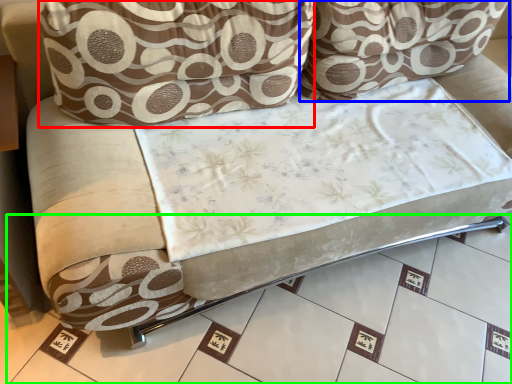
Question: Estimate the real-world distances between objects in this image. Which object is closer to throw pillow (highlighted by a red box), throw pillow (highlighted by a blue box) or tile (highlighted by a green box)?

Choices:
 (A) throw pillow
 (B) tile

Answer: (A)